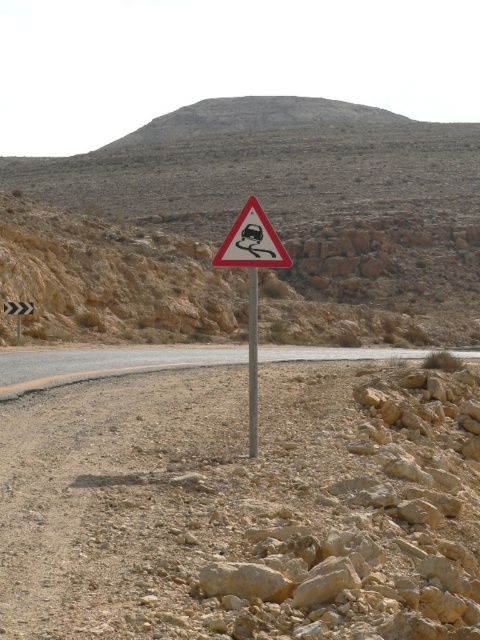
You are driving a car and see the metallic triangular sign at center mounted on the metallic pole at center. Is the sign above or below the pole?

The metallic triangular sign at center is above the metallic pole at center.

You are a delivery driver navigating the desert road shown in the image. You need to deliver a package to a location marked by a white plastic triangle at center. According to the coordinates provided, where exactly should you look for the triangle on your GPS map?

The white plastic triangle at center is located at coordinates point (252, 241), so you should look for it at that exact point on your GPS map.

From the picture: You are driving a car that is 5 meters long. You see the dirt road at center and the metallic reflective arrow at left. Can your car fit between them without overlapping either object?

The distance between the dirt road at center and the metallic reflective arrow at left is 14.55 meters. Since your car is only 5 meters long, it can easily fit between them without overlapping either object.